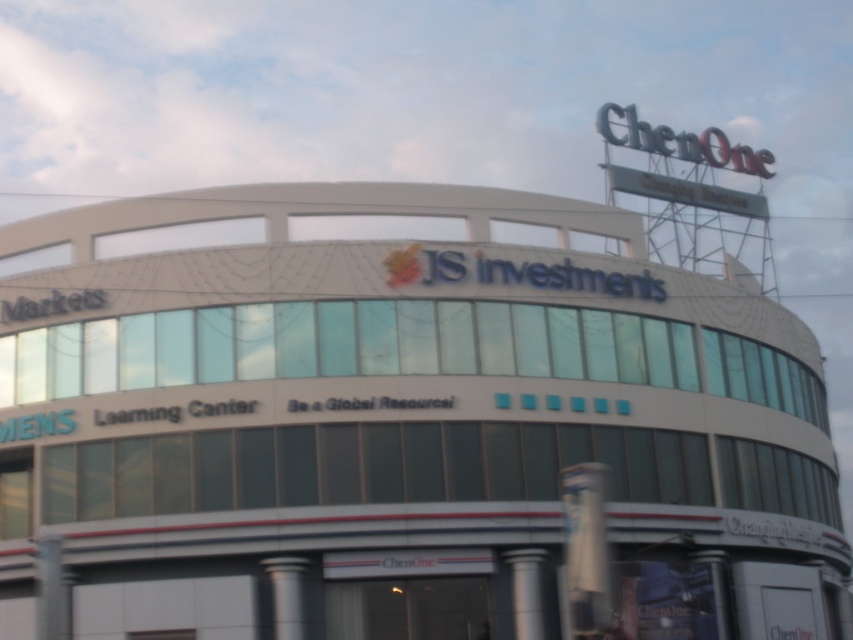
Question: Which point appears closest to the camera in this image?

Choices:
 (A) (532, 577)
 (B) (646, 371)
 (C) (281, 561)

Answer: (C)

Question: Does white glass building at center have a greater width compared to silver metallic pillar at center?

Choices:
 (A) no
 (B) yes

Answer: (B)

Question: Is white glass building at center thinner than silver metallic pillar at center?

Choices:
 (A) no
 (B) yes

Answer: (A)

Question: Based on their relative distances, which object is nearer to the silver metallic pillar at center?

Choices:
 (A) white glass building at center
 (B) silver metallic pillar at lower center

Answer: (B)

Question: Does white glass building at center appear on the right side of silver metallic pillar at lower center?

Choices:
 (A) no
 (B) yes

Answer: (B)

Question: Which object is farther from the camera taking this photo?

Choices:
 (A) white glass building at center
 (B) silver metallic pillar at center
 (C) silver metallic pillar at lower center

Answer: (B)